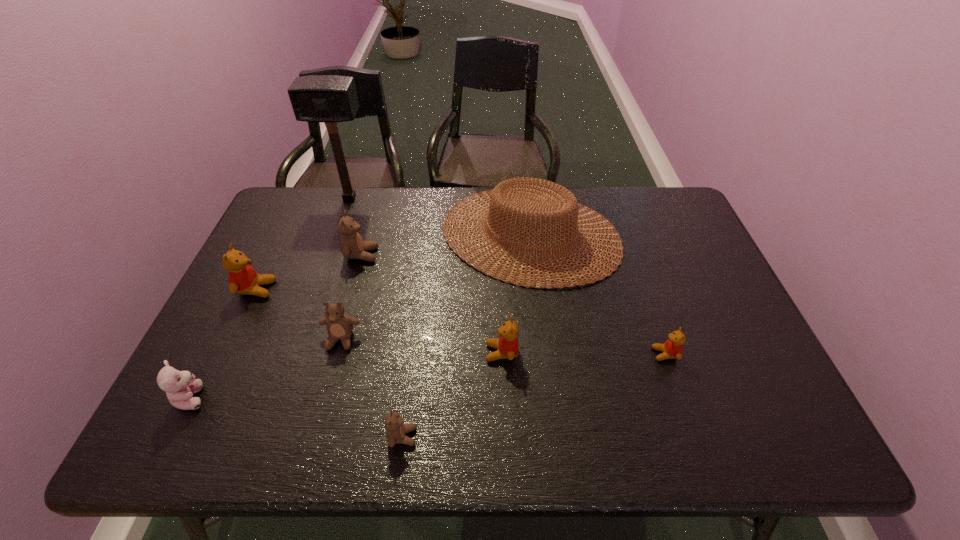
Find the location of a particular element. object that is at the near edge is located at coordinates (396, 430).

At what (x,y) coordinates should I click in order to perform the action: click on mallet present at the left edge. Please return your answer as a coordinate pair (x, y). This screenshot has height=540, width=960. Looking at the image, I should click on (330, 99).

The height and width of the screenshot is (540, 960). In order to click on object situated at the far left corner in this screenshot , I will do `click(330, 99)`.

The height and width of the screenshot is (540, 960). In the image, there is a desktop. What are the coordinates of `blank space at the far edge` in the screenshot? It's located at (352, 218).

I want to click on vacant point at the near edge, so click(x=307, y=438).

At what (x,y) coordinates should I click in order to perform the action: click on vacant area at the right edge of the desktop. Please return your answer as a coordinate pair (x, y). The image size is (960, 540). Looking at the image, I should click on 768,371.

The image size is (960, 540). In the image, there is a desktop. Find the location of `vacant space at the far left corner`. vacant space at the far left corner is located at coordinates (306, 208).

In the image, there is a desktop. Identify the location of vacant space at the near left corner. This screenshot has width=960, height=540. (237, 420).

I want to click on vacant space at the far right corner of the desktop, so click(x=668, y=207).

The width and height of the screenshot is (960, 540). I want to click on vacant space at the near right corner of the desktop, so click(x=725, y=416).